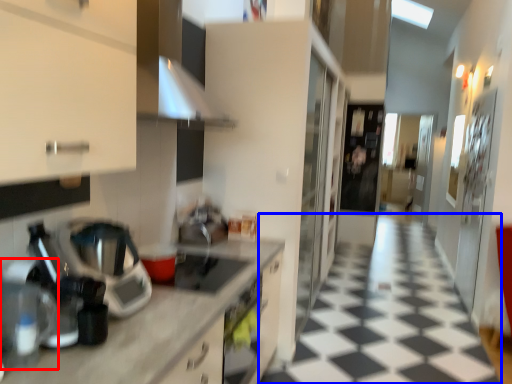
Question: Which object appears closest to the camera in this image, coffee machine (highlighted by a red box) or tile (highlighted by a blue box)?

Choices:
 (A) coffee machine
 (B) tile

Answer: (A)